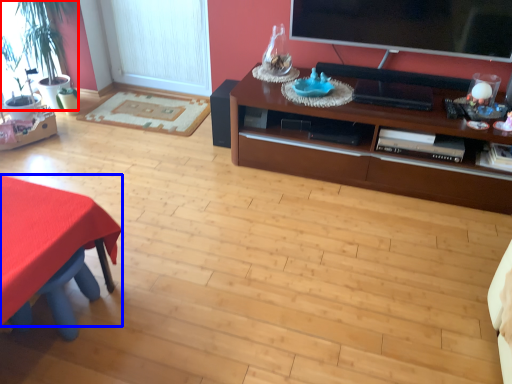
Question: Which object is closer to the camera taking this photo, houseplant (highlighted by a red box) or desk (highlighted by a blue box)?

Choices:
 (A) houseplant
 (B) desk

Answer: (B)